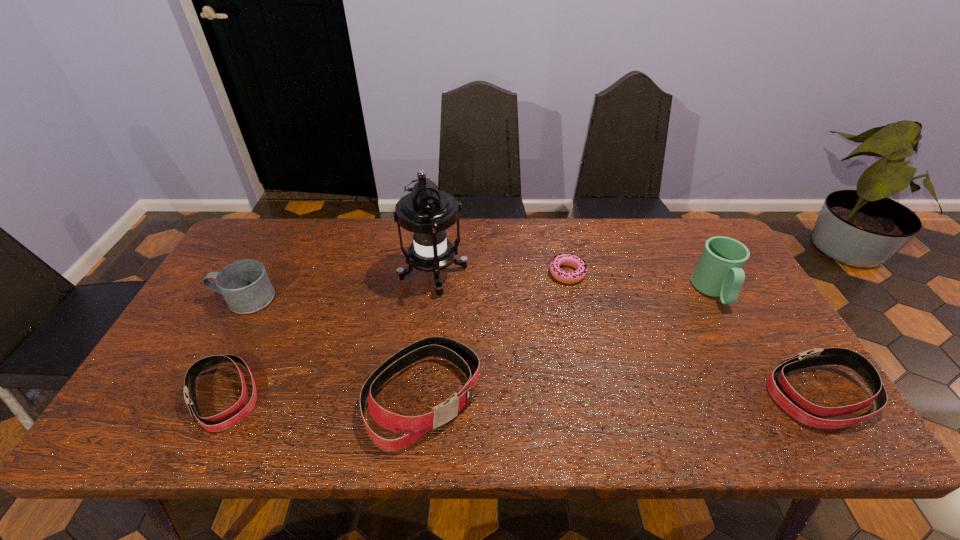
Identify the location of mug that is at the left edge. Image resolution: width=960 pixels, height=540 pixels. (245, 286).

Identify the location of dog collar situated at the right edge. (787, 398).

The width and height of the screenshot is (960, 540). I want to click on mug present at the right edge, so click(x=719, y=273).

Identify the location of object that is at the near left corner. This screenshot has height=540, width=960. (191, 375).

The width and height of the screenshot is (960, 540). I want to click on object located at the near right corner, so click(x=787, y=398).

Image resolution: width=960 pixels, height=540 pixels. In order to click on vacant space at the far edge of the desktop in this screenshot , I will do `click(347, 254)`.

In the image, there is a desktop. Where is `vacant space at the near edge`? Image resolution: width=960 pixels, height=540 pixels. vacant space at the near edge is located at coordinates (708, 384).

The height and width of the screenshot is (540, 960). I want to click on blank space at the right edge, so click(x=723, y=323).

I want to click on free space at the far left corner, so click(x=260, y=227).

Where is `vacant space at the near left corner of the desktop`? This screenshot has width=960, height=540. vacant space at the near left corner of the desktop is located at coordinates (141, 392).